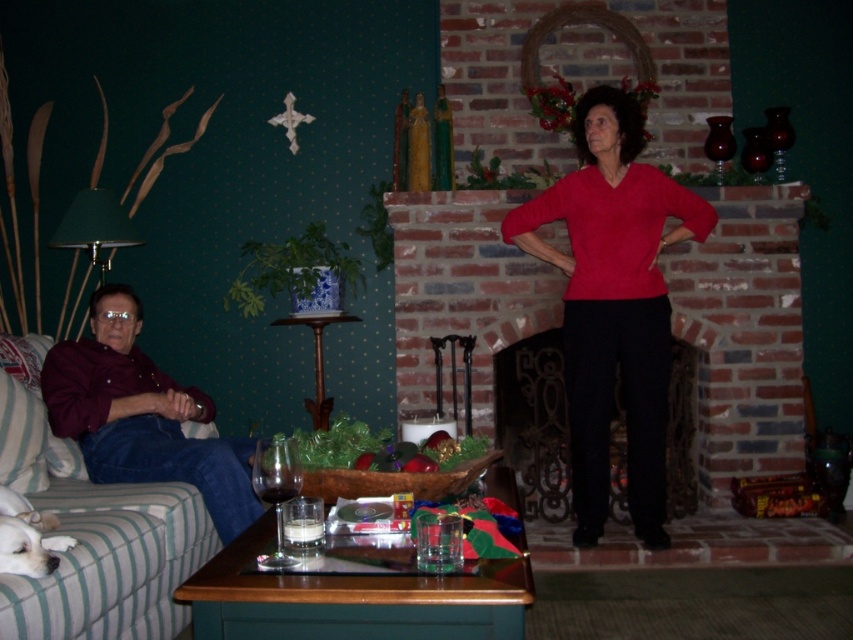
Consider the image. Does matte red sweater at center have a larger size compared to green striped fabric couch at left?

Incorrect, matte red sweater at center is not larger than green striped fabric couch at left.

Does matte red sweater at center appear on the right side of green striped fabric couch at left?

Yes, matte red sweater at center is to the right of green striped fabric couch at left.

Is point (635, 296) positioned before point (190, 547)?

No, it is not.

Image resolution: width=853 pixels, height=640 pixels. I want to click on matte red sweater at center, so click(613, 305).

Based on the photo, measure the distance from brick fireplace at center to maroon shirt at left.

brick fireplace at center is 7.10 feet from maroon shirt at left.

Is brick fireplace at center shorter than maroon shirt at left?

No, brick fireplace at center is not shorter than maroon shirt at left.

Locate an element on the screen. The width and height of the screenshot is (853, 640). brick fireplace at center is located at coordinates (741, 336).

You are a GUI agent. You are given a task and a screenshot of the screen. Output one action in this format:
    pyautogui.click(x=<x>, y=<y>)
    Task: Click on the brick fireplace at center
    Image resolution: width=853 pixels, height=640 pixels.
    Given the screenshot: What is the action you would take?
    pyautogui.click(x=741, y=336)

Does green striped fabric couch at left have a lesser width compared to maroon shirt at left?

Yes.

Does point (27, 582) come behind point (128, 451)?

That is False.

Identify the location of green striped fabric couch at left. This screenshot has height=640, width=853. (96, 538).